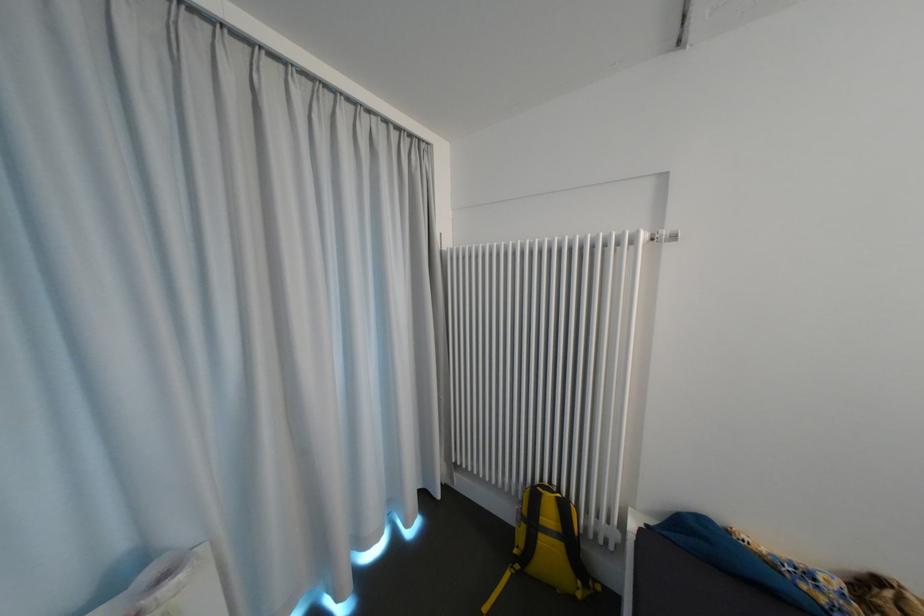
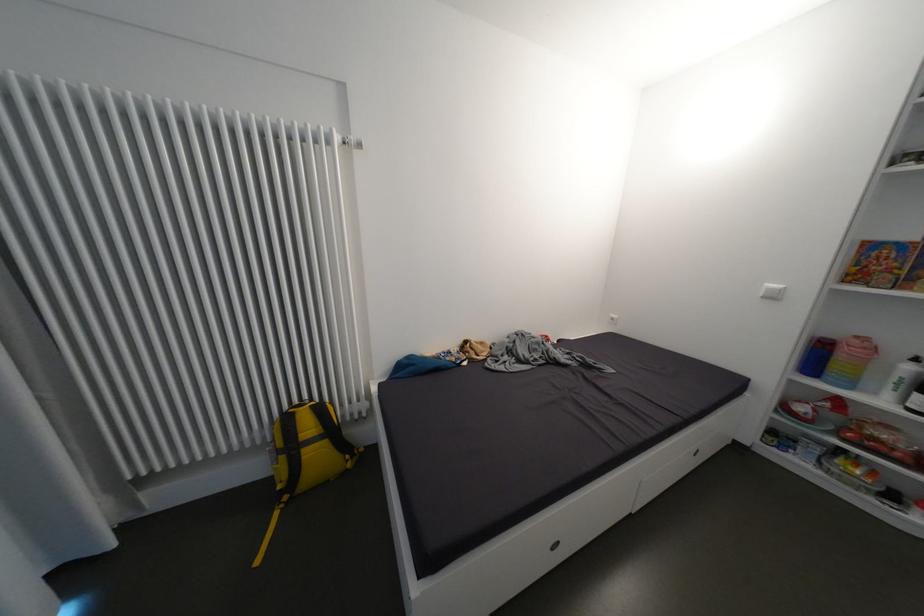
Question: The first image is from the beginning of the video and the second image is from the end. How did the camera likely rotate when shooting the video?

Choices:
 (A) Left
 (B) Right
 (C) Up
 (D) Down

Answer: (B)